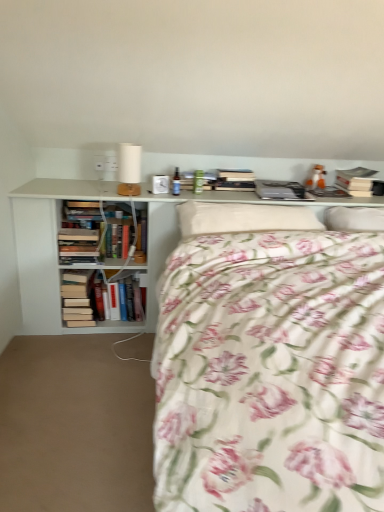
Question: Does fluffy white pillow at center, which is the 1th pillow in left-to-right order, have a greater width compared to white matte table lamp at upper center?

Choices:
 (A) no
 (B) yes

Answer: (B)

Question: From the image's perspective, would you say fluffy white pillow at center, placed as the 2th pillow when sorted from right to left, is shown under white matte table lamp at upper center?

Choices:
 (A) no
 (B) yes

Answer: (B)

Question: Does fluffy white pillow at center, placed as the 2th pillow when sorted from right to left, have a lesser height compared to white matte table lamp at upper center?

Choices:
 (A) no
 (B) yes

Answer: (B)

Question: Is fluffy white pillow at center, placed as the 2th pillow when sorted from right to left, not within white matte table lamp at upper center?

Choices:
 (A) yes
 (B) no

Answer: (A)

Question: Is fluffy white pillow at center, which is the 1th pillow in left-to-right order, at the right side of white matte table lamp at upper center?

Choices:
 (A) yes
 (B) no

Answer: (A)

Question: Considering the relative positions of hardcover books at left, which is the second book from right to left, and hardcover book at upper right, the third book when ordered from bottom to top, in the image provided, is hardcover books at left, which is the second book from right to left, to the left or to the right of hardcover book at upper right, the third book when ordered from bottom to top,?

Choices:
 (A) right
 (B) left

Answer: (B)

Question: In terms of width, does hardcover books at left, positioned as the 2th book in top-to-bottom order, look wider or thinner when compared to hardcover book at upper right, the first book in the top-to-bottom sequence?

Choices:
 (A) thin
 (B) wide

Answer: (A)

Question: From a real-world perspective, is hardcover books at left, positioned as the 2th book in top-to-bottom order, above or below hardcover book at upper right, the first book in the top-to-bottom sequence?

Choices:
 (A) above
 (B) below

Answer: (B)

Question: Is hardcover books at left, the 2th book in the left-to-right sequence, taller or shorter than hardcover book at upper right, the first book in the top-to-bottom sequence?

Choices:
 (A) tall
 (B) short

Answer: (A)

Question: From a real-world perspective, is white matte bookcase at upper center physically located above or below hardcover book at upper right, the first book in the top-to-bottom sequence?

Choices:
 (A) below
 (B) above

Answer: (A)

Question: Is white matte bookcase at upper center to the left or to the right of hardcover book at upper right, the third book when ordered from bottom to top, in the image?

Choices:
 (A) left
 (B) right

Answer: (A)

Question: Looking at the image, does white matte bookcase at upper center seem bigger or smaller compared to hardcover book at upper right, positioned as the 1th book in right-to-left order?

Choices:
 (A) big
 (B) small

Answer: (A)

Question: Considering the positions of white matte bookcase at upper center and hardcover book at upper right, the first book in the top-to-bottom sequence, in the image, is white matte bookcase at upper center taller or shorter than hardcover book at upper right, the first book in the top-to-bottom sequence,?

Choices:
 (A) short
 (B) tall

Answer: (B)

Question: Relative to floral cotton bed at center, is hardcover book at upper right, positioned as the 1th book in right-to-left order, in front or behind?

Choices:
 (A) behind
 (B) front

Answer: (A)

Question: From their relative heights in the image, would you say hardcover book at upper right, the third book when ordered from bottom to top, is taller or shorter than floral cotton bed at center?

Choices:
 (A) short
 (B) tall

Answer: (A)